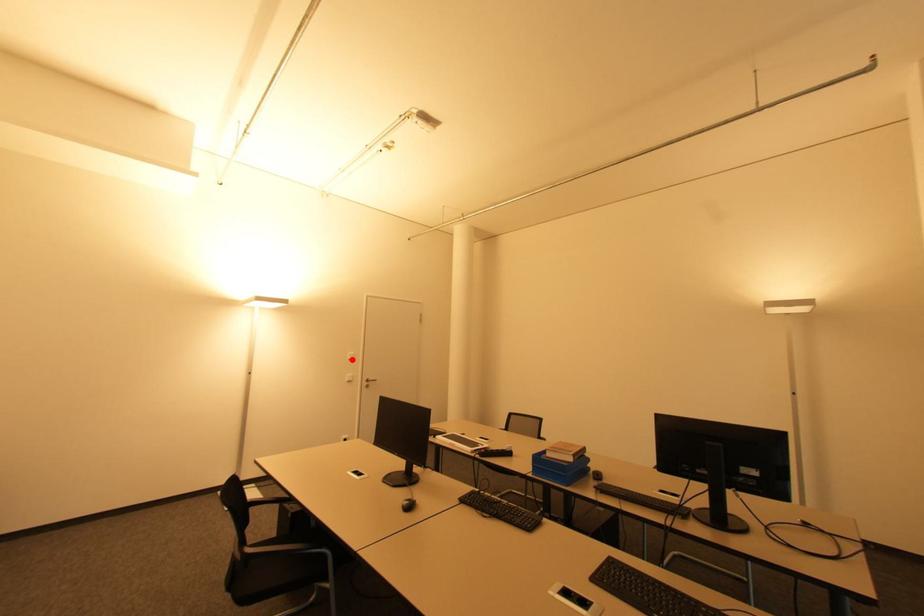
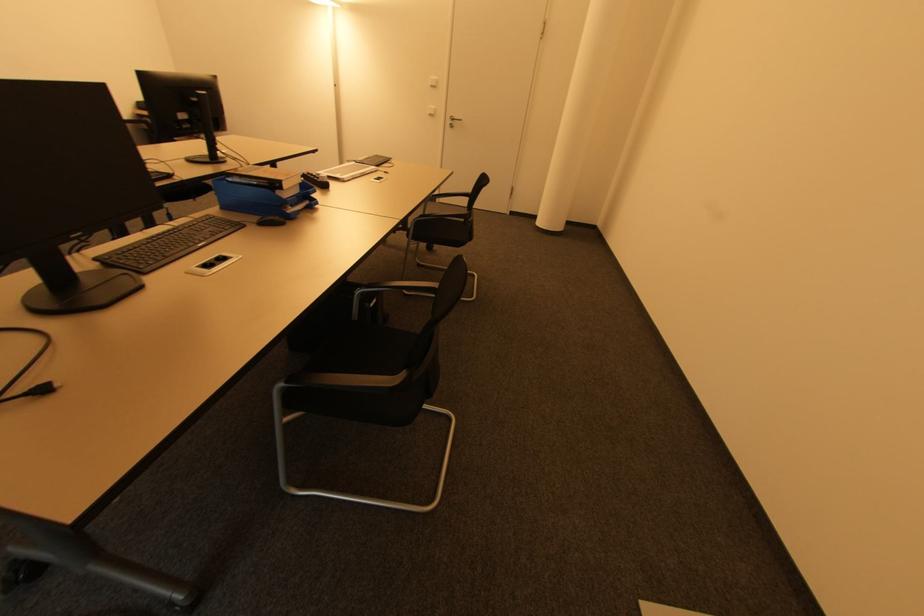
Question: I am providing you with two images of the same scene from different viewpoints. A red point is shown in image1. For the corresponding object point in image2, is it positioned nearer or farther from the camera?

Choices:
 (A) Nearer
 (B) Farther

Answer: (A)